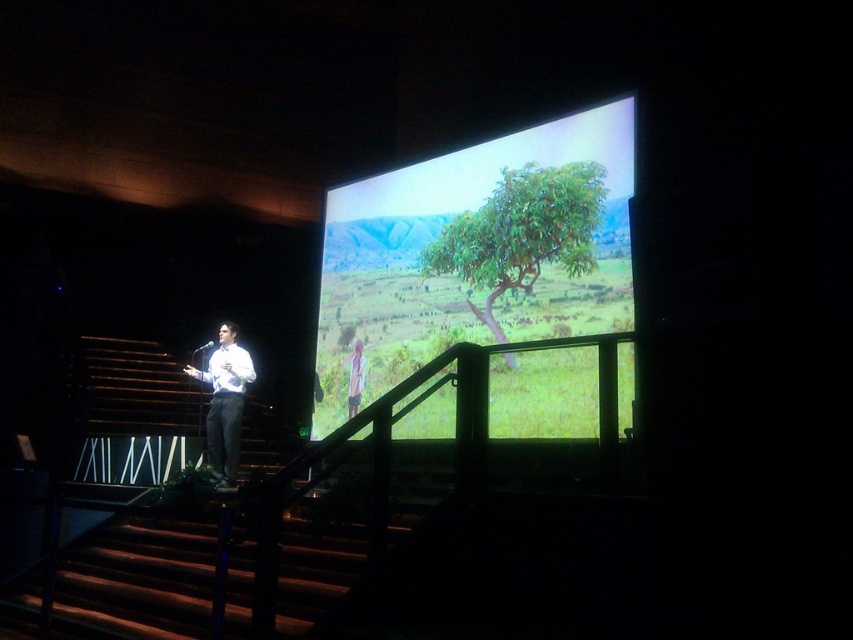
Question: Is dark wood stairs at lower left to the left of light brown fabric shirt at center from the viewer's perspective?

Choices:
 (A) yes
 (B) no

Answer: (A)

Question: Can you confirm if green matte tree at center is positioned above green leafy tree at center?

Choices:
 (A) no
 (B) yes

Answer: (A)

Question: Among these points, which one is farthest from the camera?

Choices:
 (A) (361, 573)
 (B) (352, 390)

Answer: (B)

Question: Considering the real-world distances, which object is farthest from the green matte tree at center?

Choices:
 (A) light brown fabric shirt at center
 (B) dark wood stairs at lower left
 (C) white shirt at center
 (D) green leafy tree at center

Answer: (B)

Question: Considering the relative positions of dark wood stairs at lower left and light brown fabric shirt at center in the image provided, where is dark wood stairs at lower left located with respect to light brown fabric shirt at center?

Choices:
 (A) above
 (B) below

Answer: (B)

Question: Which object appears closest to the camera in this image?

Choices:
 (A) green leafy tree at center
 (B) dark wood stairs at lower left

Answer: (B)